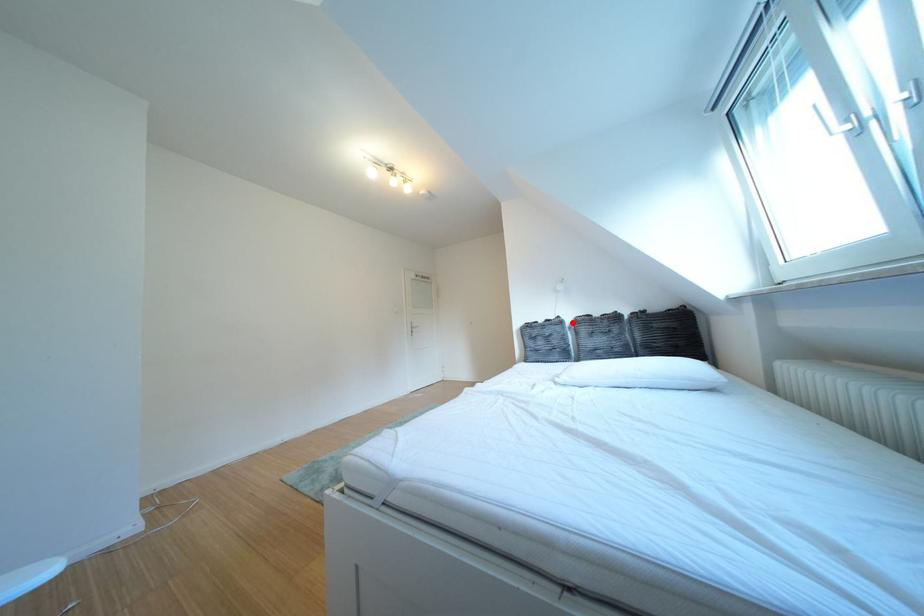
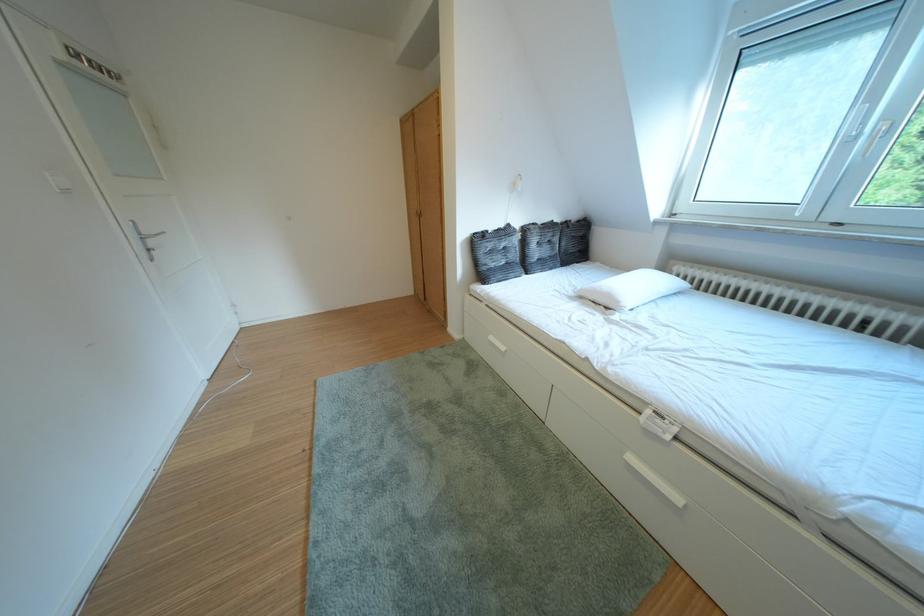
Find the pixel in the second image that matches the highlighted location in the first image.

(523, 230)